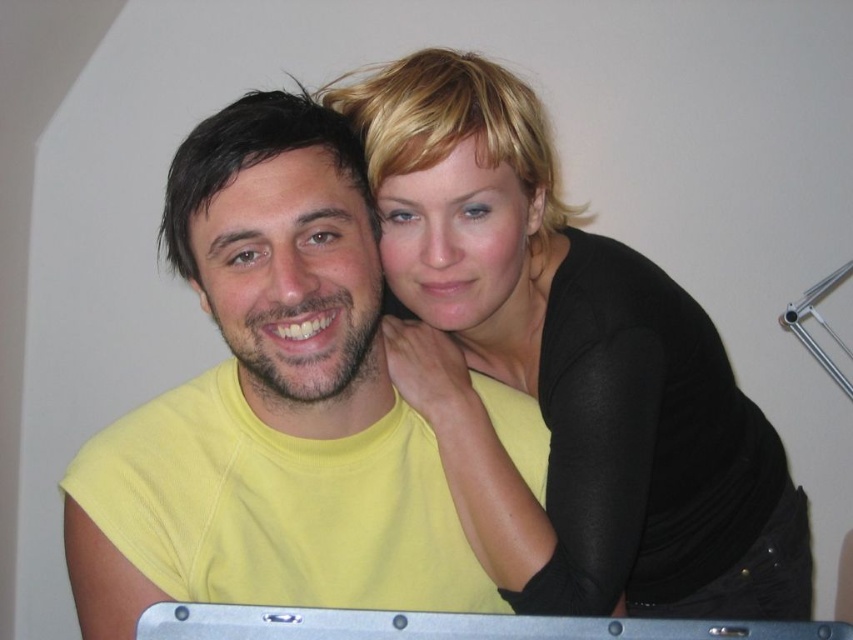
Based on the photo, can you confirm if black matte shirt at upper right is bigger than silver metallic laptop at lower center?

Yes.

Which is behind, point (386, 227) or point (187, 604)?

Positioned behind is point (386, 227).

At what (x,y) coordinates should I click in order to perform the action: click on black matte shirt at upper right. Please return your answer as a coordinate pair (x, y). Looking at the image, I should click on (569, 368).

Can you confirm if black matte shirt at upper right is bigger than yellow matte t-shirt at center?

Correct, black matte shirt at upper right is larger in size than yellow matte t-shirt at center.

Is black matte shirt at upper right above yellow matte t-shirt at center?

No.

Is point (709, 464) behind point (180, 468)?

Yes, point (709, 464) is farther from viewer.

Identify the location of black matte shirt at upper right. (569, 368).

Can you confirm if yellow matte t-shirt at center is thinner than silver metallic laptop at lower center?

Yes, yellow matte t-shirt at center is thinner than silver metallic laptop at lower center.

Is point (146, 428) farther from camera compared to point (589, 627)?

That is True.

The image size is (853, 640). I want to click on yellow matte t-shirt at center, so click(270, 404).